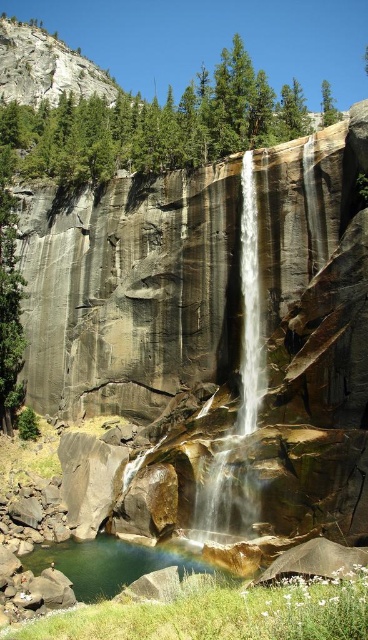
You are standing at the base of the waterfall and want to reach the misty spray area. You notice two points marked in the image. Which point is closer to you, point (255, 317) or point (107, 563)?

Point (107, 563) is closer to you because it is less further to the viewer than point (255, 317).

You are a photographer planning to capture the waterfall and the pool below. You want to ensure that both the white smooth waterfall at center and the clear water at lower center are visible in your shot. Based on their widths, which object should you position closer to the edge of the frame to avoid overcrowding the composition?

Since the white smooth waterfall at center has a lesser width compared to clear water at lower center, you should position the white smooth waterfall at center closer to the edge of the frame to avoid overcrowding the composition, as it takes up less space.

You are a hiker who wants to cross from the cliff to the pool below. The white smooth waterfall at center is in your way. Can you safely walk around it to reach the clear water at lower center? The distance between them is 13.28 meters. Assume you can walk on the rocks. Answer based on the distance provided.

The distance between the white smooth waterfall at center and the clear water at lower center is 13.28 meters. Since you can walk on the rocks, you can safely navigate around the waterfall to reach the clear water at lower center.